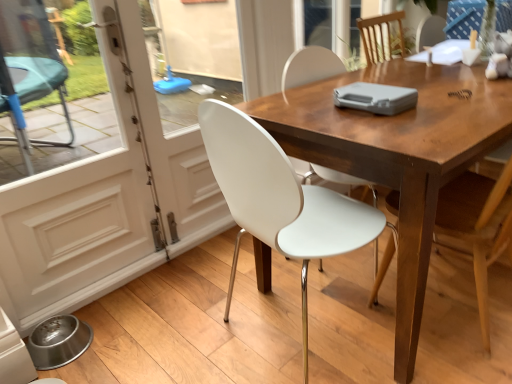
You are a GUI agent. You are given a task and a screenshot of the screen. Output one action in this format:
    pyautogui.click(x=<x>, y=<y>)
    Task: Click on the free area in between white plastic chair at center, marked as the second chair in a right-to-left arrangement, and wooden chair at center, the second chair from the left
    
    Given the screenshot: What is the action you would take?
    pyautogui.click(x=387, y=316)